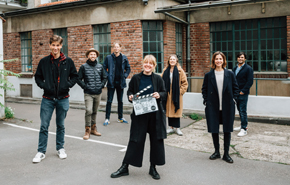
Identify the location of window. (268, 47), (247, 39), (221, 46), (156, 43), (179, 37), (64, 39), (96, 39), (27, 47).